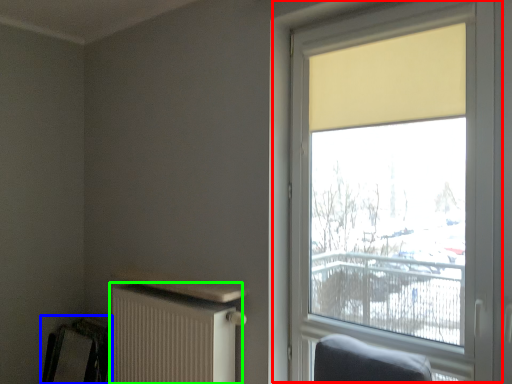
Question: Which object is the closest to the window (highlighted by a red box)? Choose among these: swivel chair (highlighted by a blue box) or radiator (highlighted by a green box).

Choices:
 (A) swivel chair
 (B) radiator

Answer: (B)